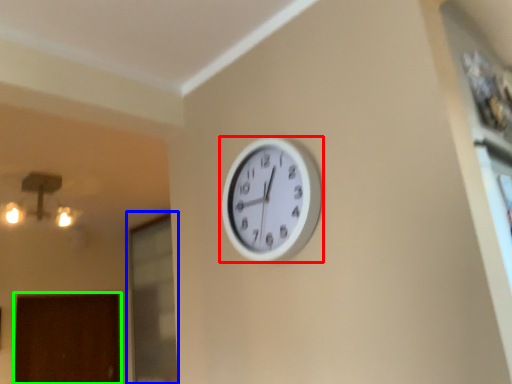
Question: Which is nearer to the wall clock (highlighted by a red box)? glass door (highlighted by a blue box) or door (highlighted by a green box).

Choices:
 (A) glass door
 (B) door

Answer: (A)